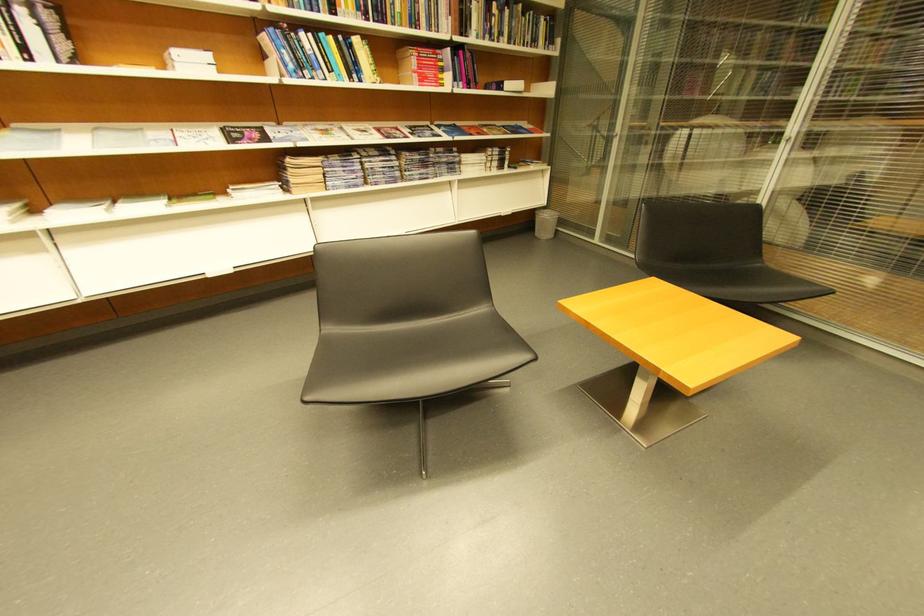
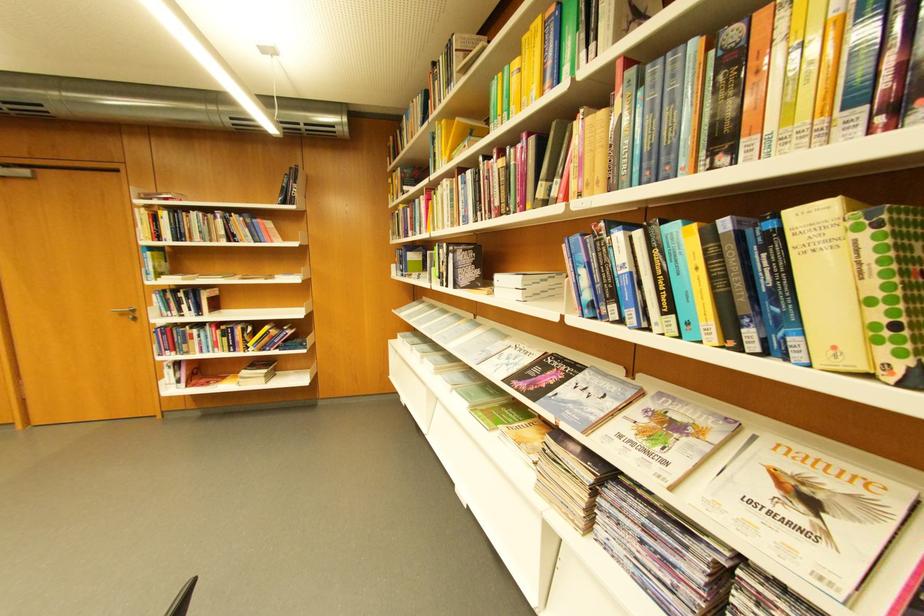
Find the pixel in the second image that matches pixel 343 71 in the first image.

(681, 310)